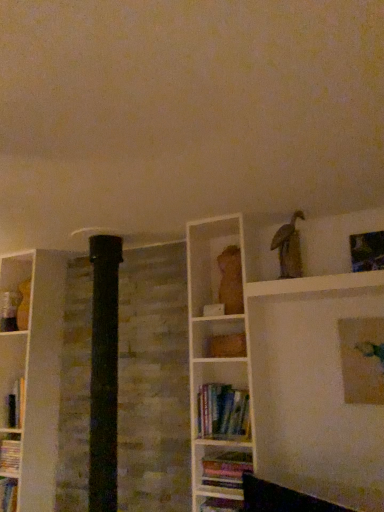
Question: Is point (369, 340) positioned closer to the camera than point (206, 462)?

Choices:
 (A) farther
 (B) closer

Answer: (B)

Question: Is matte gold picture frame at upper right, the 2th picture frame from the top, taller or shorter than multicolored paper book at lower center, the first book positioned from the bottom?

Choices:
 (A) tall
 (B) short

Answer: (A)

Question: Estimate the real-world distances between objects in this image. Which object is farther from the hardcover books at center, which is the 1th book in top-to-bottom order?

Choices:
 (A) metallic silver picture frame at upper right, which appears as the 1th picture frame when viewed from the top
 (B) matte gold picture frame at upper right, the 2th picture frame from the top
 (C) multicolored paper book at lower center, the first book positioned from the bottom

Answer: (A)

Question: Estimate the real-world distances between objects in this image. Which object is closer to the multicolored paper book at lower center, the first book positioned from the bottom?

Choices:
 (A) metallic silver picture frame at upper right, which is the second picture frame in bottom-to-top order
 (B) hardcover books at center, the second book when ordered from bottom to top
 (C) matte gold picture frame at upper right, the 2th picture frame from the top

Answer: (B)